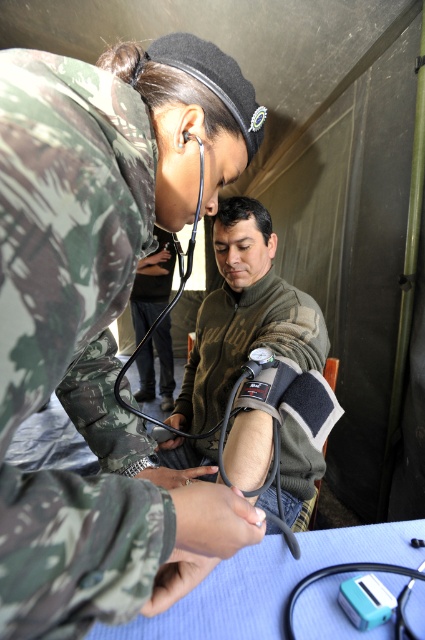
Question: Is camouflage fabric blood pressure cuff at center thinner than camouflage fabric uniform at center?

Choices:
 (A) no
 (B) yes

Answer: (A)

Question: Is camouflage fabric blood pressure cuff at center below teal plastic stethoscope at lower center?

Choices:
 (A) no
 (B) yes

Answer: (A)

Question: Which point appears farthest from the camera in this image?

Choices:
 (A) (158, 284)
 (B) (226, 364)
 (C) (286, 632)

Answer: (A)

Question: Estimate the real-world distances between objects in this image. Which object is closer to the camouflage fabric blood pressure cuff at center?

Choices:
 (A) camouflage fabric uniform at center
 (B) camo uniform at center

Answer: (B)

Question: Is camo uniform at center smaller than camouflage fabric blood pressure cuff at center?

Choices:
 (A) yes
 (B) no

Answer: (A)

Question: Which point is farther to the camera?

Choices:
 (A) pos(260,237)
 (B) pos(405,573)

Answer: (A)